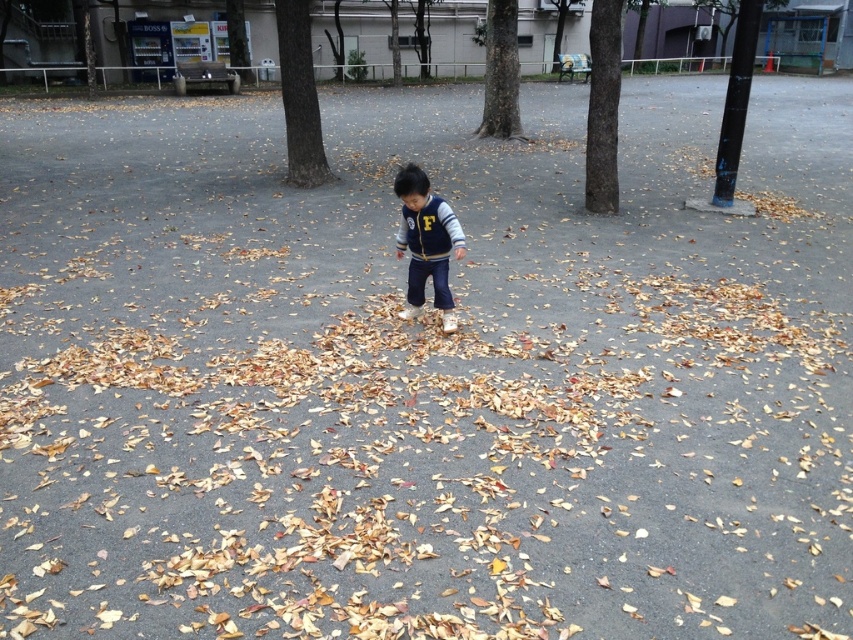
Consider the image. Is brown rough bark tree at center bigger than smooth bark tree at center?

Actually, brown rough bark tree at center might be smaller than smooth bark tree at center.

Between point (606, 164) and point (506, 113), which one is positioned behind?

The point (506, 113) is more distant.

At what (x,y) coordinates should I click in order to perform the action: click on brown rough bark tree at center. Please return your answer as a coordinate pair (x, y). Looking at the image, I should click on (602, 106).

Where is `brown rough bark tree at center`? The width and height of the screenshot is (853, 640). brown rough bark tree at center is located at coordinates (602, 106).

This screenshot has width=853, height=640. What do you see at coordinates (299, 96) in the screenshot?
I see `brown rough bark tree at upper center` at bounding box center [299, 96].

Which is more to the left, brown rough bark tree at upper center or smooth bark tree at center?

brown rough bark tree at upper center

This screenshot has width=853, height=640. Describe the element at coordinates (299, 96) in the screenshot. I see `brown rough bark tree at upper center` at that location.

Identify the location of brown rough bark tree at upper center. (299, 96).

Which of these two, brown rough bark tree at upper center or brown rough bark tree at center, stands taller?

brown rough bark tree at center

Is brown rough bark tree at upper center bigger than brown rough bark tree at center?

No.

Which is in front, point (305, 147) or point (614, 209)?

Point (614, 209) is more forward.

Locate an element on the screen. brown rough bark tree at upper center is located at coordinates (299, 96).